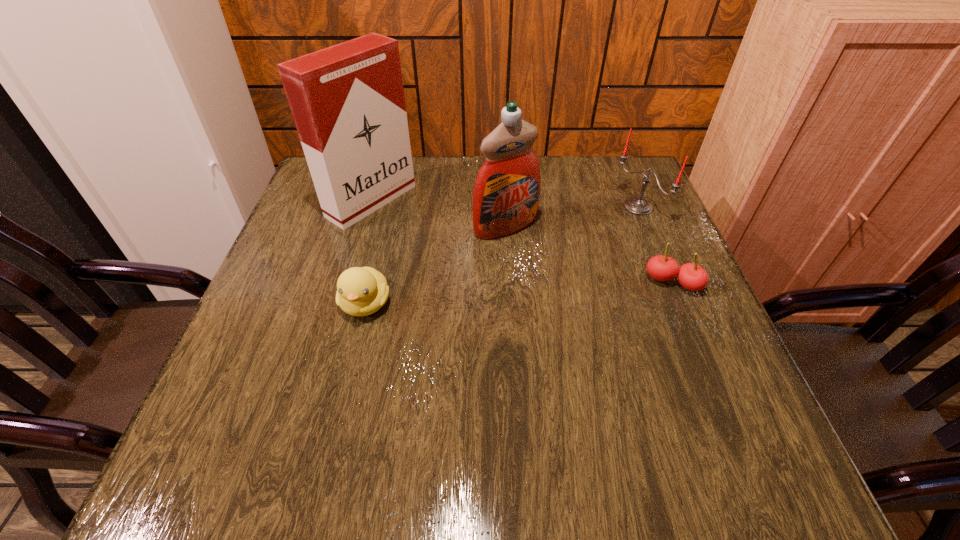
Where is `duckling`? This screenshot has height=540, width=960. duckling is located at coordinates (361, 291).

Find the location of a particular element. This screenshot has width=960, height=540. cherry is located at coordinates (693, 277).

Locate an element on the screen. cigarette_case is located at coordinates (347, 100).

Where is `the third object from right to left`? the third object from right to left is located at coordinates (506, 194).

I want to click on detergent, so click(506, 194).

I want to click on the third tallest object, so click(636, 205).

Find the location of a particular element. This screenshot has height=540, width=960. free space located 0.120m on the front of the cherry is located at coordinates (699, 346).

You are a GUI agent. You are given a task and a screenshot of the screen. Output one action in this format:
    pyautogui.click(x=<x>, y=<y>)
    Task: Click on the vacant space located 0.390m on the front-facing side of the tallest object
    This screenshot has width=960, height=540.
    Given the screenshot: What is the action you would take?
    pyautogui.click(x=528, y=295)

Where is `free space located 0.330m on the front-facing side of the tallest object`? free space located 0.330m on the front-facing side of the tallest object is located at coordinates (505, 281).

Identify the location of free space located on the front-facing side of the tallest object. Image resolution: width=960 pixels, height=540 pixels. (473, 262).